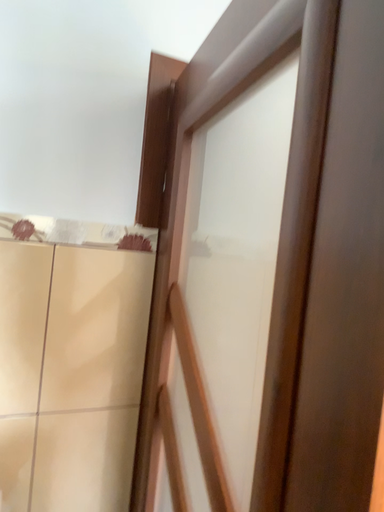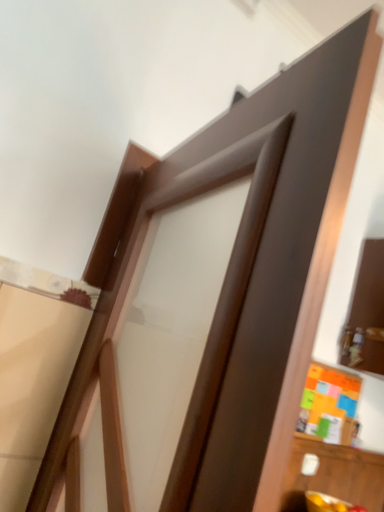
Question: Which way did the camera rotate in the video?

Choices:
 (A) rotated left
 (B) rotated right

Answer: (B)